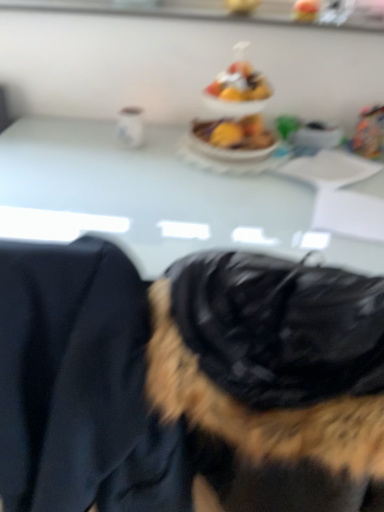
Where is `shiny plastic fruit bowl at center`? The height and width of the screenshot is (512, 384). shiny plastic fruit bowl at center is located at coordinates (236, 114).

This screenshot has height=512, width=384. Describe the element at coordinates (146, 193) in the screenshot. I see `white glossy table at center` at that location.

Looking at this image, measure the distance between black fur coat at center and camera.

black fur coat at center and camera are 24.60 inches apart from each other.

The height and width of the screenshot is (512, 384). Identify the location of shiny plastic fruit bowl at center. (236, 114).

Between shiny plastic fruit bowl at center and black fur coat at center, which one appears on the left side from the viewer's perspective?

shiny plastic fruit bowl at center.

From the image's perspective, between shiny plastic fruit bowl at center and black fur coat at center, who is located below?

black fur coat at center is shown below in the image.

Image resolution: width=384 pixels, height=512 pixels. I want to click on food above the black fur coat at center (from the image's perspective), so click(236, 114).

Is black fur coat at center at the back of shiny plastic fruit bowl at center?

No, black fur coat at center is not at the back of shiny plastic fruit bowl at center.

From a real-world perspective, between shiny plastic fruit bowl at center and white glossy table at center, who is vertically lower?

white glossy table at center, from a real-world perspective.

From the image's perspective, is shiny plastic fruit bowl at center below white glossy table at center?

No.

Does shiny plastic fruit bowl at center have a lesser width compared to white glossy table at center?

Indeed, shiny plastic fruit bowl at center has a lesser width compared to white glossy table at center.

Considering the sizes of objects shiny plastic fruit bowl at center and white glossy table at center in the image provided, who is smaller, shiny plastic fruit bowl at center or white glossy table at center?

shiny plastic fruit bowl at center is smaller.

Considering the relative sizes of white glossy table at center and black fur coat at center in the image provided, is white glossy table at center taller than black fur coat at center?

In fact, white glossy table at center may be shorter than black fur coat at center.

Looking at this image, between white glossy table at center and black fur coat at center, which one appears on the right side from the viewer's perspective?

From the viewer's perspective, black fur coat at center appears more on the right side.

Which is nearer, (160,231) or (274,490)?

The point (274,490) is in front.

Is white glossy table at center in contact with black fur coat at center?

No, white glossy table at center is not making contact with black fur coat at center.

Which of these two, white glossy table at center or shiny plastic fruit bowl at center, is wider?

Wider between the two is white glossy table at center.

Is white glossy table at center bigger than shiny plastic fruit bowl at center?

Yes.

Is white glossy table at center taller than shiny plastic fruit bowl at center?

Correct, white glossy table at center is much taller as shiny plastic fruit bowl at center.

Can white glossy table at center be found inside black fur coat at center?

No.

Is the depth of black fur coat at center less than that of white glossy table at center?

Yes.

Which is closer to the camera, (229, 437) or (268, 230)?

Clearly, point (229, 437) is closer to the camera than point (268, 230).

Is black fur coat at center next to shiny plastic fruit bowl at center and touching it?

black fur coat at center is not next to shiny plastic fruit bowl at center, and they're not touching.

Which object is wider, black fur coat at center or shiny plastic fruit bowl at center?

black fur coat at center.

Considering the relative sizes of black fur coat at center and shiny plastic fruit bowl at center in the image provided, is black fur coat at center smaller than shiny plastic fruit bowl at center?

No, black fur coat at center is not smaller than shiny plastic fruit bowl at center.

Find the location of a particular element. This screenshot has width=384, height=512. dog below the shiny plastic fruit bowl at center (from the image's perspective) is located at coordinates (187, 382).

In order to click on food behind the black fur coat at center in this screenshot , I will do `click(236, 114)`.

The height and width of the screenshot is (512, 384). I want to click on food above the white glossy table at center (from the image's perspective), so click(236, 114).

In the scene shown: Estimate the real-world distances between objects in this image. Which object is further from black fur coat at center, shiny plastic fruit bowl at center or white glossy table at center?

shiny plastic fruit bowl at center lies further to black fur coat at center than the other object.

Based on their spatial positions, is black fur coat at center or white glossy table at center closer to shiny plastic fruit bowl at center?

white glossy table at center lies closer to shiny plastic fruit bowl at center than the other object.

From the image, which object appears to be farther from black fur coat at center, white glossy table at center or shiny plastic fruit bowl at center?

The object further to black fur coat at center is shiny plastic fruit bowl at center.

Which object lies further to the anchor point shiny plastic fruit bowl at center, white glossy table at center or black fur coat at center?

black fur coat at center lies further to shiny plastic fruit bowl at center than the other object.

Considering their positions, is black fur coat at center positioned closer to white glossy table at center than shiny plastic fruit bowl at center?

shiny plastic fruit bowl at center lies closer to white glossy table at center than the other object.

Which object lies nearer to the anchor point white glossy table at center, shiny plastic fruit bowl at center or black fur coat at center?

The object closer to white glossy table at center is shiny plastic fruit bowl at center.

Identify the location of table between shiny plastic fruit bowl at center and black fur coat at center in the up-down direction. Image resolution: width=384 pixels, height=512 pixels. (146, 193).